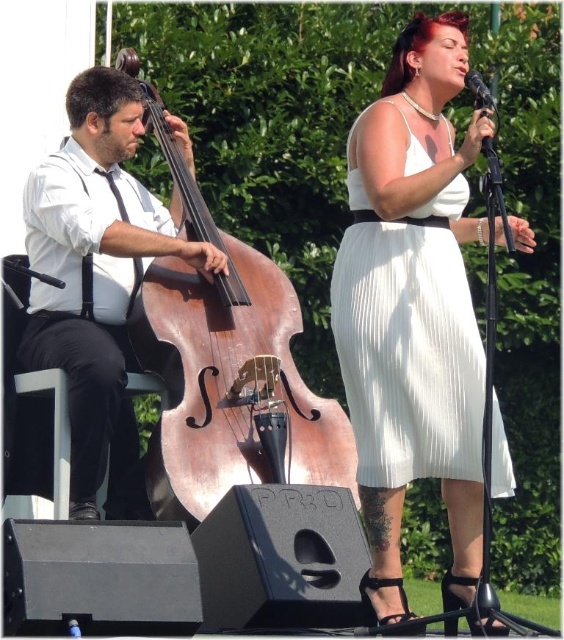
Does matte black double bass at left appear over black matte microphone at upper right?

Actually, matte black double bass at left is below black matte microphone at upper right.

Does point (92, 390) come behind point (481, 80)?

Yes, it is behind point (481, 80).

Is point (33, 344) behind point (466, 77)?

Yes, point (33, 344) is farther from viewer.

Where is `matte black double bass at left`? The height and width of the screenshot is (640, 564). matte black double bass at left is located at coordinates (98, 280).

Between point (473, 316) and point (479, 106), which one is positioned behind?

Positioned behind is point (473, 316).

Is white pleated dress at center in front of black matte microphone at upper right?

No, white pleated dress at center is further to the viewer.

Where is `white pleated dress at center`? This screenshot has height=640, width=564. white pleated dress at center is located at coordinates (409, 346).

Locate an element on the screen. white pleated dress at center is located at coordinates (409, 346).

Does matte black double bass at left appear on the left side of white pleated dress at center?

Correct, you'll find matte black double bass at left to the left of white pleated dress at center.

How distant is matte black double bass at left from white pleated dress at center?

They are 4.56 meters apart.

Is point (117, 212) positioned after point (363, 442)?

Yes, point (117, 212) is behind point (363, 442).

Locate an element on the screen. matte black double bass at left is located at coordinates (98, 280).